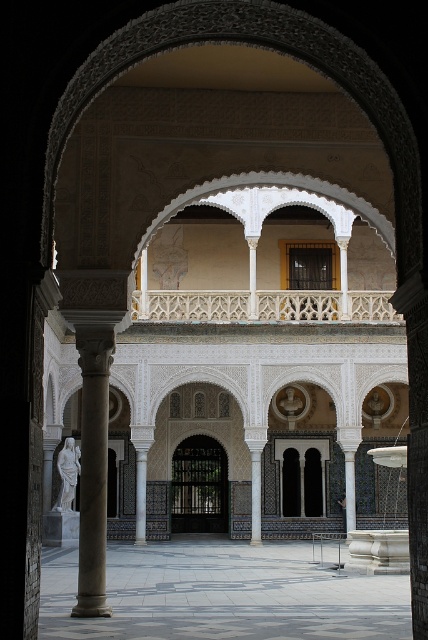
Question: Which of these objects is positioned farthest from the white marble statue at left?

Choices:
 (A) white marble column at center
 (B) white marble pillar at center

Answer: (B)

Question: Is polished stone floor at center positioned at the back of polished stone column at left?

Choices:
 (A) yes
 (B) no

Answer: (B)

Question: Which point is farther to the camera?

Choices:
 (A) white marble statue at left
 (B) white marble column at center

Answer: (B)

Question: Which point is closer to the camera?

Choices:
 (A) coord(77,595)
 (B) coord(145,497)
 (C) coord(256,484)
 (D) coord(196,637)

Answer: (D)

Question: Can you confirm if polished stone floor at center is wider than white marble pillar at center?

Choices:
 (A) no
 (B) yes

Answer: (B)

Question: Is polished stone floor at center to the left of polished stone column at left from the viewer's perspective?

Choices:
 (A) yes
 (B) no

Answer: (B)